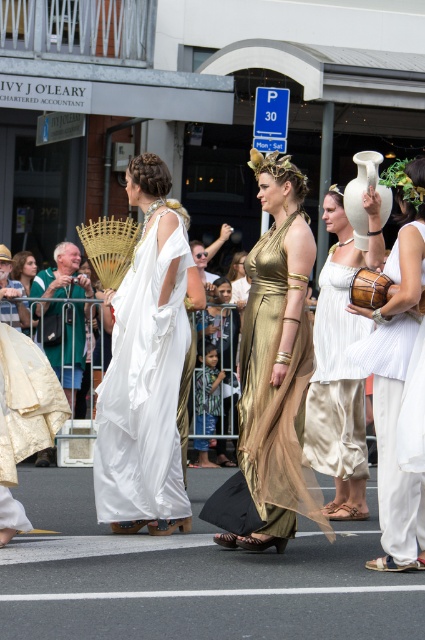
Does metallic gold dress at center have a lesser height compared to gold metallic dress at center?

No.

Between metallic gold dress at center and gold metallic dress at center, which one has more height?

metallic gold dress at center

In the scene shown: Who is more forward, (249, 428) or (260, 282)?

Point (249, 428) is more forward.

Identify the location of metallic gold dress at center. This screenshot has height=640, width=425. (275, 381).

Is gold metallic dress at center wider than white matte vase at right?

Answer: Correct, the width of gold metallic dress at center exceeds that of white matte vase at right.

Who is higher up, gold metallic dress at center or white matte vase at right?

gold metallic dress at center is above.

Does point (263, 244) come closer to viewer compared to point (391, 179)?

No, it is behind (391, 179).

Image resolution: width=425 pixels, height=640 pixels. I want to click on gold metallic dress at center, so click(272, 376).

Can you confirm if white matte vase at right is bigger than white silk dress at center?

No.

Can you confirm if white matte vase at right is positioned above white silk dress at center?

No.

Identify the location of white matte vase at right. (396, 372).

Where is `white matte vase at right`? The width and height of the screenshot is (425, 640). white matte vase at right is located at coordinates click(x=396, y=372).